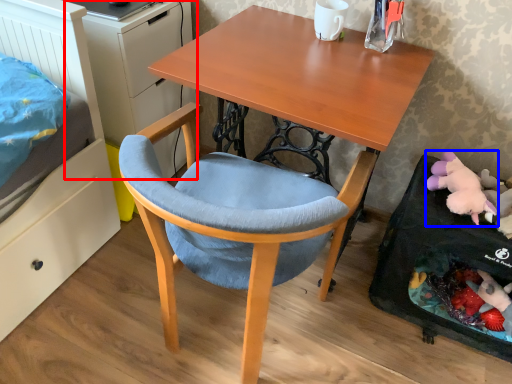
Question: Which object is further to the camera taking this photo, dresser (highlighted by a red box) or toy (highlighted by a blue box)?

Choices:
 (A) dresser
 (B) toy

Answer: (A)